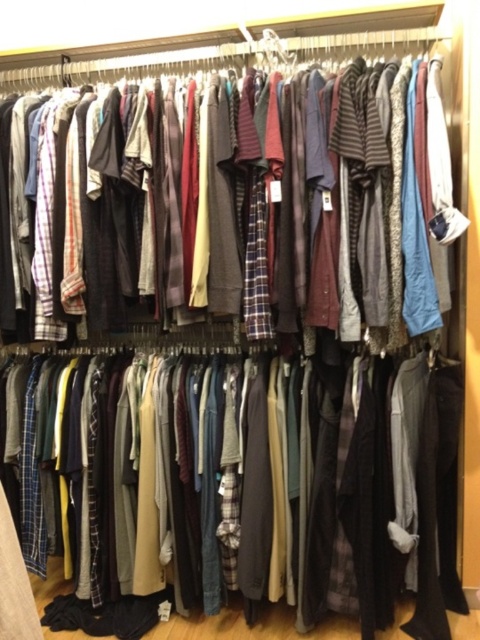
Question: Can you confirm if dark gray sweater at center is bigger than plaid fabric shirts at center?

Choices:
 (A) no
 (B) yes

Answer: (B)

Question: Is dark gray sweater at center above plaid fabric shirts at center?

Choices:
 (A) yes
 (B) no

Answer: (B)

Question: Which object is closer to the camera taking this photo?

Choices:
 (A) plaid fabric shirts at center
 (B) dark gray sweater at center

Answer: (A)

Question: Is dark gray sweater at center to the right of plaid fabric shirts at center from the viewer's perspective?

Choices:
 (A) yes
 (B) no

Answer: (B)

Question: Which object appears closest to the camera in this image?

Choices:
 (A) dark gray sweater at center
 (B) plaid fabric shirts at center

Answer: (B)

Question: Which object is closer to the camera taking this photo?

Choices:
 (A) dark gray sweater at center
 (B) plaid fabric shirts at center

Answer: (B)